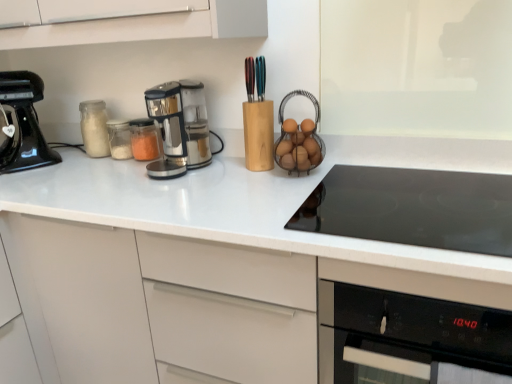
Locate an element on the screen. This screenshot has height=384, width=512. sleek metallic coffee maker at center, arranged as the 2th kitchen appliance when viewed from the left is located at coordinates (179, 127).

This screenshot has height=384, width=512. Describe the element at coordinates (412, 208) in the screenshot. I see `black glass cooktop at center` at that location.

Locate an element on the screen. The height and width of the screenshot is (384, 512). white glossy countertop at center is located at coordinates (256, 200).

What do you see at coordinates (94, 128) in the screenshot? The width and height of the screenshot is (512, 384). I see `translucent glass jar at left` at bounding box center [94, 128].

This screenshot has width=512, height=384. What are the coordinates of `black glossy stand mixer at left, positioned as the first kitchen appliance in left-to-right order` in the screenshot? It's located at (25, 122).

Where is `sleek metallic coffee maker at center, arranged as the 2th kitchen appliance when viewed from the left`? The image size is (512, 384). sleek metallic coffee maker at center, arranged as the 2th kitchen appliance when viewed from the left is located at coordinates (179, 127).

Which of these two, white glossy countertop at center or translucent glass jar at left, is wider?

white glossy countertop at center is wider.

Considering the relative sizes of white glossy countertop at center and translucent glass jar at left in the image provided, is white glossy countertop at center smaller than translucent glass jar at left?

Actually, white glossy countertop at center might be larger than translucent glass jar at left.

From the image's perspective, does white glossy countertop at center appear lower than translucent glass jar at left?

Yes, from the image's perspective, white glossy countertop at center is below translucent glass jar at left.

From a real-world perspective, does translucent glass jar at left stand above white glossy countertop at center?

Correct, in the physical world, translucent glass jar at left is higher than white glossy countertop at center.

Considering the positions of objects translucent glass jar at left and white glossy countertop at center in the image provided, who is more to the right, translucent glass jar at left or white glossy countertop at center?

From the viewer's perspective, white glossy countertop at center appears more on the right side.

Considering the positions of point (88, 151) and point (159, 210), is point (88, 151) closer or farther from the camera than point (159, 210)?

Clearly, point (88, 151) is more distant from the camera than point (159, 210).

Is black glossy stand mixer at left, positioned as the first kitchen appliance in left-to-right order, further to the viewer compared to white glossy countertop at center?

That is True.

In the scene shown: From a real-world perspective, which is physically below, black glossy stand mixer at left, positioned as the first kitchen appliance in left-to-right order, or white glossy countertop at center?

white glossy countertop at center is physically lower.

Are black glossy stand mixer at left, the second kitchen appliance viewed from the right, and white glossy countertop at center far apart?

black glossy stand mixer at left, the second kitchen appliance viewed from the right, is near white glossy countertop at center, not far away.

Which object is closer to the camera, black glossy stand mixer at left, positioned as the first kitchen appliance in left-to-right order, or black glass cooktop at center?

black glass cooktop at center is closer to the camera.

Can you confirm if black glossy stand mixer at left, positioned as the first kitchen appliance in left-to-right order, is smaller than black glass cooktop at center?

Actually, black glossy stand mixer at left, positioned as the first kitchen appliance in left-to-right order, might be larger than black glass cooktop at center.

Is black glass cooktop at center located within black glossy stand mixer at left, positioned as the first kitchen appliance in left-to-right order?

No.

How many degrees apart are the facing directions of black glossy stand mixer at left, positioned as the first kitchen appliance in left-to-right order, and black glass cooktop at center?

Answer: 44.7 degrees.

Can you confirm if white glossy countertop at center is positioned to the left of black glossy stand mixer at left, the second kitchen appliance viewed from the right?

No.

Would you say white glossy countertop at center is outside black glossy stand mixer at left, the second kitchen appliance viewed from the right?

white glossy countertop at center is positioned outside black glossy stand mixer at left, the second kitchen appliance viewed from the right.

From the image's perspective, would you say white glossy countertop at center is positioned over black glossy stand mixer at left, the second kitchen appliance viewed from the right?

No, from the image's perspective, white glossy countertop at center is not above black glossy stand mixer at left, the second kitchen appliance viewed from the right.

Measure the distance from white glossy countertop at center to black glossy stand mixer at left, positioned as the first kitchen appliance in left-to-right order.

white glossy countertop at center and black glossy stand mixer at left, positioned as the first kitchen appliance in left-to-right order, are 19.78 inches apart.

Where is `bottle that is under the sleek metallic coffee maker at center, the first kitchen appliance viewed from the right (from a real-world perspective)`? The height and width of the screenshot is (384, 512). bottle that is under the sleek metallic coffee maker at center, the first kitchen appliance viewed from the right (from a real-world perspective) is located at coordinates (94, 128).

Would you say translucent glass jar at left is outside sleek metallic coffee maker at center, arranged as the 2th kitchen appliance when viewed from the left?

Absolutely, translucent glass jar at left is external to sleek metallic coffee maker at center, arranged as the 2th kitchen appliance when viewed from the left.

Between translucent glass jar at left and sleek metallic coffee maker at center, arranged as the 2th kitchen appliance when viewed from the left, which one is positioned behind?

translucent glass jar at left is more distant.

Between translucent glass jar at left and sleek metallic coffee maker at center, the first kitchen appliance viewed from the right, which one appears on the right side from the viewer's perspective?

From the viewer's perspective, sleek metallic coffee maker at center, the first kitchen appliance viewed from the right, appears more on the right side.

Would you say black glass cooktop at center is to the left or to the right of white glossy countertop at center in the picture?

black glass cooktop at center is to the right of white glossy countertop at center.

Is point (422, 241) positioned before point (342, 242)?

Yes.

Is black glass cooktop at center turned away from white glossy countertop at center?

That's right, black glass cooktop at center is facing away from white glossy countertop at center.

Would you say white glossy countertop at center is part of black glass cooktop at center's contents?

No.

Find the location of a particular element. countertop below the translucent glass jar at left (from a real-world perspective) is located at coordinates (256, 200).

Find the location of a particular element. bottle that is on the left side of white glossy countertop at center is located at coordinates (94, 128).

Which object lies further to the anchor point black glass oven at lower right, translucent glass jar at left or sleek metallic coffee maker at center, arranged as the 2th kitchen appliance when viewed from the left?

translucent glass jar at left lies further to black glass oven at lower right than the other object.

Which object lies nearer to the anchor point black glass cooktop at center, black glass oven at lower right or sleek metallic coffee maker at center, the first kitchen appliance viewed from the right?

The object closer to black glass cooktop at center is black glass oven at lower right.

Based on their spatial positions, is black glass oven at lower right or white glossy countertop at center closer to sleek metallic coffee maker at center, arranged as the 2th kitchen appliance when viewed from the left?

The object closer to sleek metallic coffee maker at center, arranged as the 2th kitchen appliance when viewed from the left, is white glossy countertop at center.

Based on their spatial positions, is black glass oven at lower right or translucent glass jar at left further from black glass cooktop at center?

Among the two, translucent glass jar at left is located further to black glass cooktop at center.

When comparing their distances from black glass oven at lower right, does black glass cooktop at center or sleek metallic coffee maker at center, the first kitchen appliance viewed from the right, seem further?

Based on the image, sleek metallic coffee maker at center, the first kitchen appliance viewed from the right, appears to be further to black glass oven at lower right.

Consider the image. When comparing their distances from sleek metallic coffee maker at center, the first kitchen appliance viewed from the right, does black glass oven at lower right or translucent glass jar at left seem closer?

The object closer to sleek metallic coffee maker at center, the first kitchen appliance viewed from the right, is translucent glass jar at left.

From the image, which object appears to be farther from translucent glass jar at left, sleek metallic coffee maker at center, the first kitchen appliance viewed from the right, or white glossy countertop at center?

The object further to translucent glass jar at left is white glossy countertop at center.

Looking at the image, which one is located further to black glass cooktop at center, sleek metallic coffee maker at center, arranged as the 2th kitchen appliance when viewed from the left, or black glass oven at lower right?

sleek metallic coffee maker at center, arranged as the 2th kitchen appliance when viewed from the left.

Locate an element on the screen. This screenshot has width=512, height=384. countertop located between translucent glass jar at left and black glass oven at lower right in the left-right direction is located at coordinates (256, 200).

Identify the location of gas stove between black glossy stand mixer at left, positioned as the first kitchen appliance in left-to-right order, and black glass oven at lower right. (412, 208).

The height and width of the screenshot is (384, 512). Find the location of `kitchen appliance situated between black glossy stand mixer at left, positioned as the first kitchen appliance in left-to-right order, and black glass cooktop at center from left to right`. kitchen appliance situated between black glossy stand mixer at left, positioned as the first kitchen appliance in left-to-right order, and black glass cooktop at center from left to right is located at coordinates (179, 127).

The height and width of the screenshot is (384, 512). I want to click on bottle between black glossy stand mixer at left, positioned as the first kitchen appliance in left-to-right order, and black glass cooktop at center, in the horizontal direction, so click(x=94, y=128).